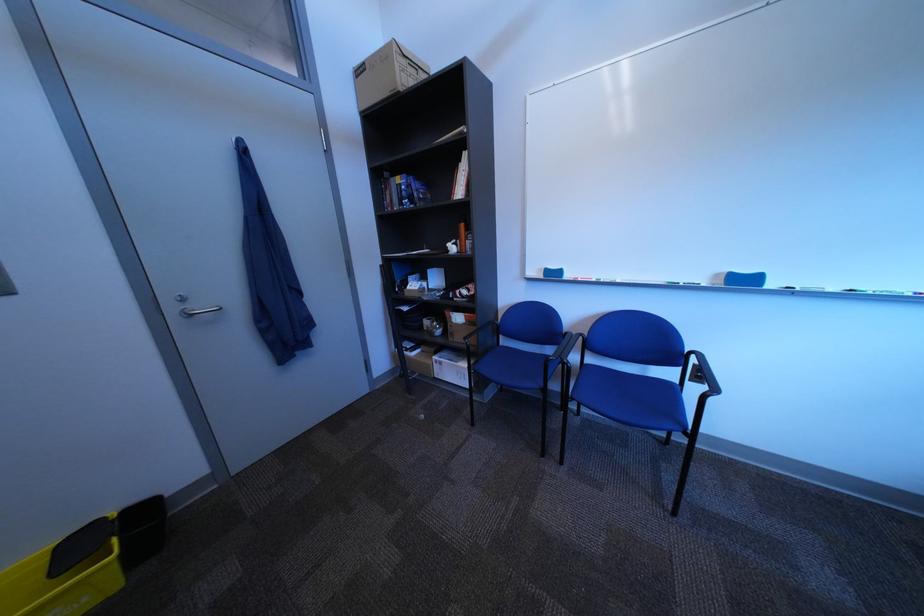
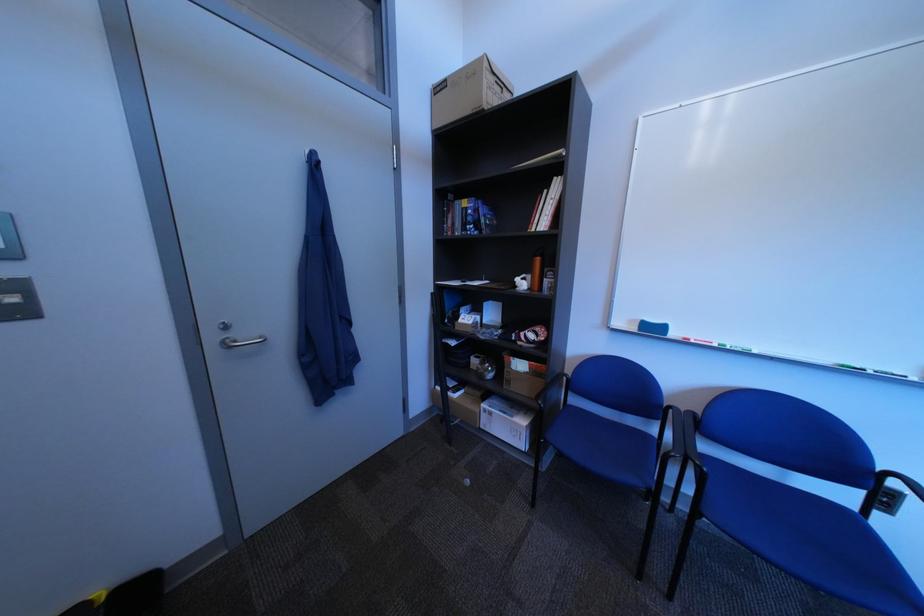
The point at (187, 310) is marked in the first image. Where is the corresponding point in the second image?

(226, 339)